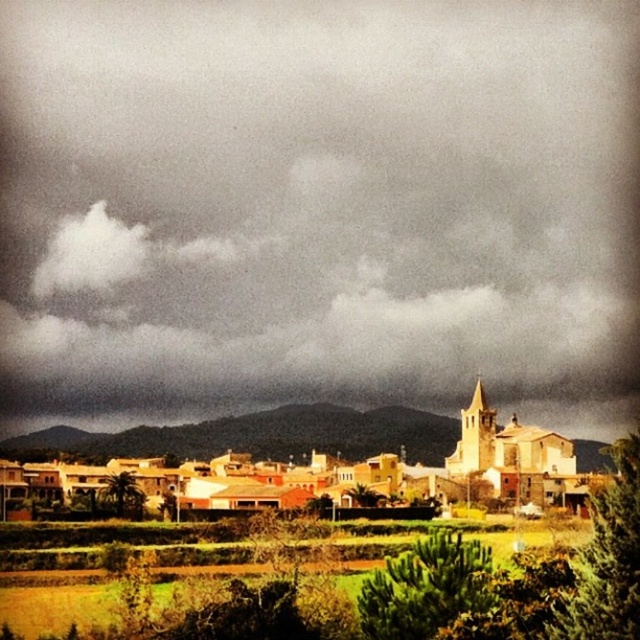
Is point (330, 189) in front of point (500, 444)?

No, it is not.

Can you confirm if dark gray cloud at upper center is bigger than light brown stone church at center?

Indeed, dark gray cloud at upper center has a larger size compared to light brown stone church at center.

Which is in front, point (141, 164) or point (532, 458)?

Point (532, 458)

Identify the location of dark gray cloud at upper center. (317, 208).

Does white stucco buildings at center have a larger size compared to light brown stone church at center?

Correct, white stucco buildings at center is larger in size than light brown stone church at center.

Is white stucco buildings at center above light brown stone church at center?

Yes, white stucco buildings at center is above light brown stone church at center.

Who is more distant from viewer, (276, 429) or (493, 490)?

The point (276, 429) is behind.

In order to click on white stucco buildings at center in this screenshot , I will do `click(260, 435)`.

Does dark gray cloud at upper center have a lesser height compared to white stucco buildings at center?

No, dark gray cloud at upper center is not shorter than white stucco buildings at center.

Does dark gray cloud at upper center have a smaller size compared to white stucco buildings at center?

No.

You are a GUI agent. You are given a task and a screenshot of the screen. Output one action in this format:
    pyautogui.click(x=<x>, y=<y>)
    Task: Click on the dark gray cloud at upper center
    This screenshot has height=640, width=640.
    Given the screenshot: What is the action you would take?
    pyautogui.click(x=317, y=208)